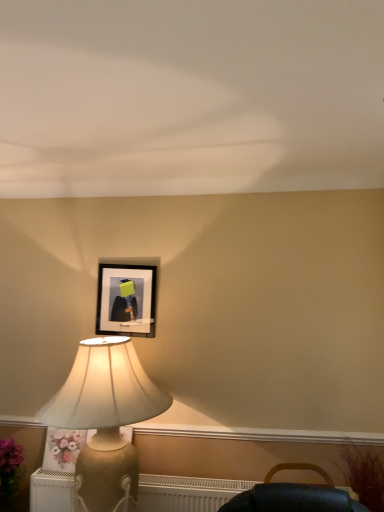
Question: Is white textured radiator at lower left not inside gold textured lamp at left?

Choices:
 (A) no
 (B) yes

Answer: (A)

Question: Is white textured radiator at lower left turned away from gold textured lamp at left?

Choices:
 (A) yes
 (B) no

Answer: (A)

Question: From a real-world perspective, is white textured radiator at lower left beneath gold textured lamp at left?

Choices:
 (A) yes
 (B) no

Answer: (A)

Question: Can you see white textured radiator at lower left touching gold textured lamp at left?

Choices:
 (A) no
 (B) yes

Answer: (A)

Question: Does white textured radiator at lower left have a greater height compared to gold textured lamp at left?

Choices:
 (A) yes
 (B) no

Answer: (B)

Question: From a real-world perspective, is floral fabric pillow at lower left positioned above or below black matte picture frame at upper center?

Choices:
 (A) below
 (B) above

Answer: (A)

Question: Considering the positions of floral fabric pillow at lower left and black matte picture frame at upper center in the image, is floral fabric pillow at lower left bigger or smaller than black matte picture frame at upper center?

Choices:
 (A) small
 (B) big

Answer: (A)

Question: Considering the positions of floral fabric pillow at lower left and black matte picture frame at upper center in the image, is floral fabric pillow at lower left taller or shorter than black matte picture frame at upper center?

Choices:
 (A) tall
 (B) short

Answer: (B)

Question: Relative to black matte picture frame at upper center, is floral fabric pillow at lower left in front or behind?

Choices:
 (A) front
 (B) behind

Answer: (A)

Question: In the image, is white textured radiator at lower left on the left side or the right side of floral fabric pillow at lower left?

Choices:
 (A) right
 (B) left

Answer: (A)

Question: Relative to floral fabric pillow at lower left, is white textured radiator at lower left in front or behind?

Choices:
 (A) front
 (B) behind

Answer: (A)

Question: From the image's perspective, relative to floral fabric pillow at lower left, is white textured radiator at lower left above or below?

Choices:
 (A) below
 (B) above

Answer: (A)

Question: Is white textured radiator at lower left inside the boundaries of floral fabric pillow at lower left, or outside?

Choices:
 (A) inside
 (B) outside

Answer: (B)

Question: In the image, is gold textured lamp at left positioned in front of or behind black matte picture frame at upper center?

Choices:
 (A) front
 (B) behind

Answer: (A)

Question: Is gold textured lamp at left situated inside black matte picture frame at upper center or outside?

Choices:
 (A) inside
 (B) outside

Answer: (B)